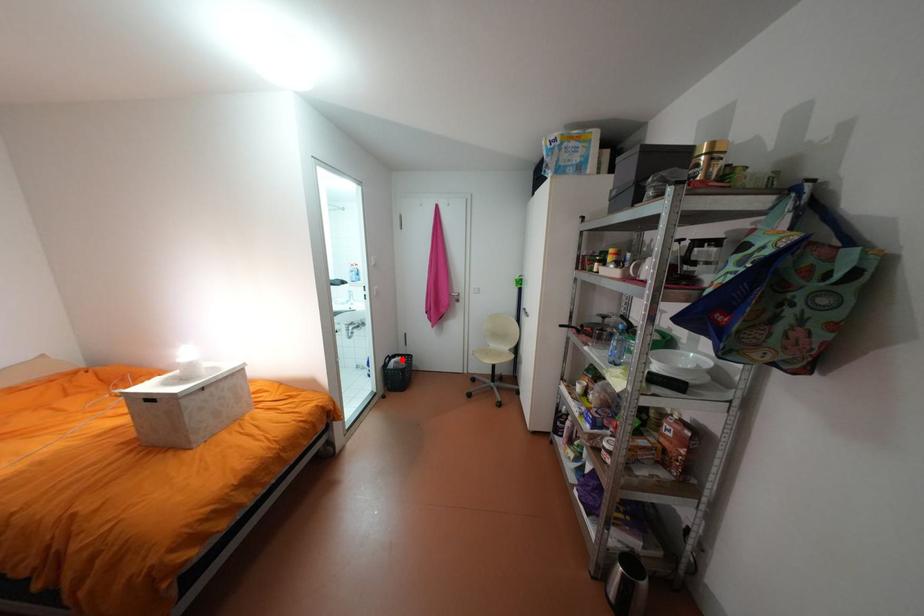
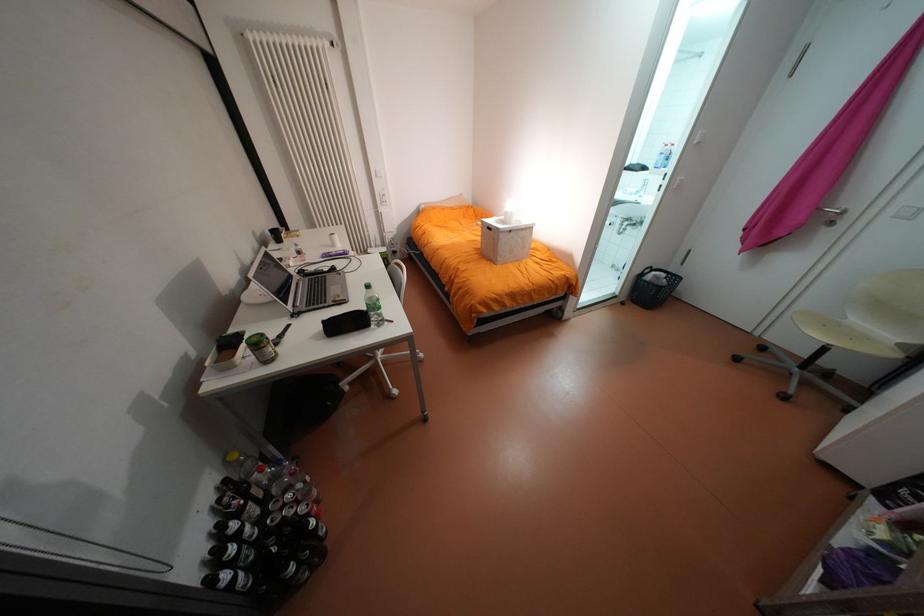
The point at the highlighted location is marked in the first image. Where is the corresponding point in the second image?

(663, 273)